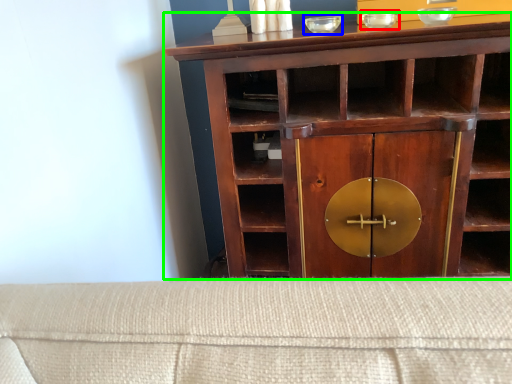
Question: Considering the real-world distances, which object is farthest from glass bowl (highlighted by a red box)? glass bowl (highlighted by a blue box) or cupboard (highlighted by a green box)?

Choices:
 (A) glass bowl
 (B) cupboard

Answer: (B)